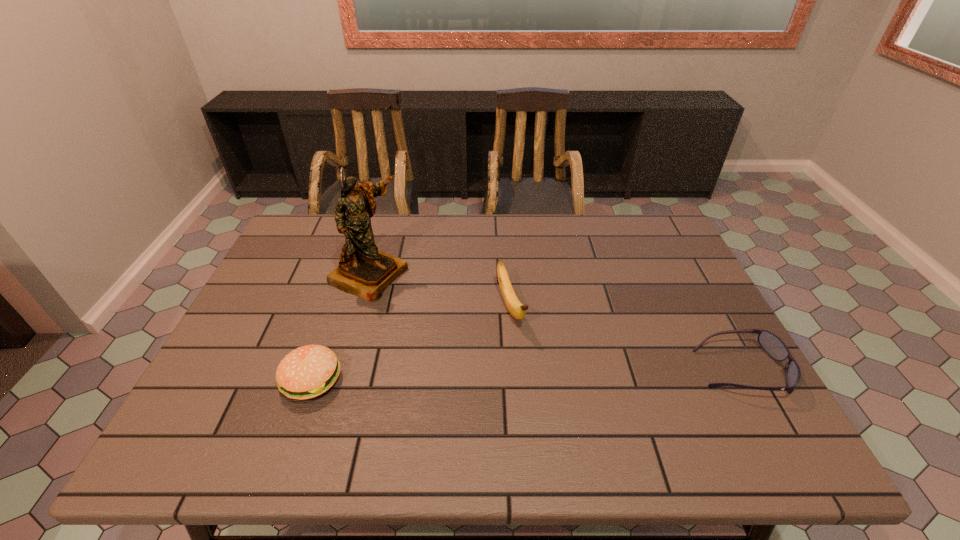
The width and height of the screenshot is (960, 540). I want to click on free space on the desktop that is between the patty and the rightmost object and is positioned at the stem of the third object from left to right, so click(x=541, y=374).

At what (x,y) coordinates should I click in order to perform the action: click on vacant space on the desktop that is between the patty and the rightmost object and is positioned on the front-facing side of the figurine. Please return your answer as a coordinate pair (x, y). Looking at the image, I should click on (591, 373).